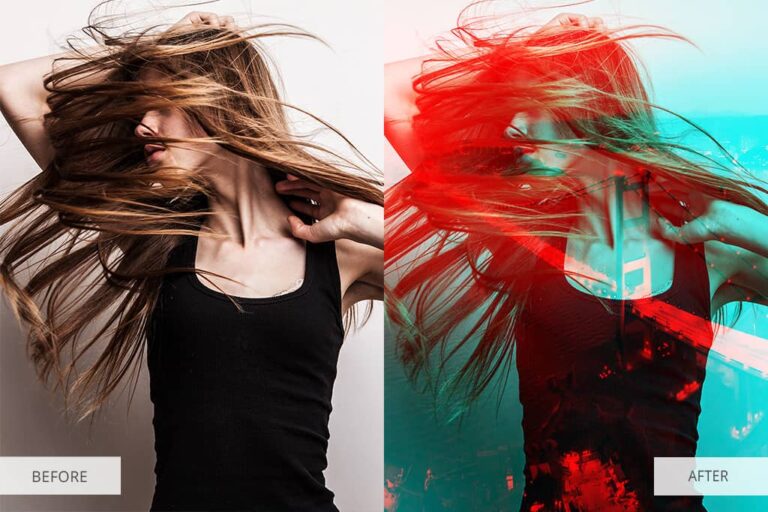
Identify the location of wall. The width and height of the screenshot is (768, 512). (348, 421), (118, 430).